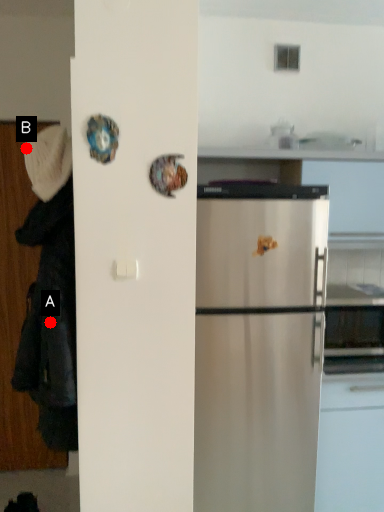
Question: Two points are circled on the image, labeled by A and B beside each circle. Which point appears farthest from the camera in this image?

Choices:
 (A) A is further
 (B) B is further

Answer: (B)